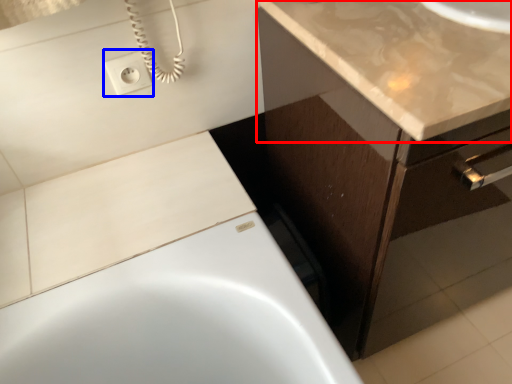
Question: Among these objects, which one is farthest to the camera, countertop (highlighted by a red box) or electric outlet (highlighted by a blue box)?

Choices:
 (A) countertop
 (B) electric outlet

Answer: (B)